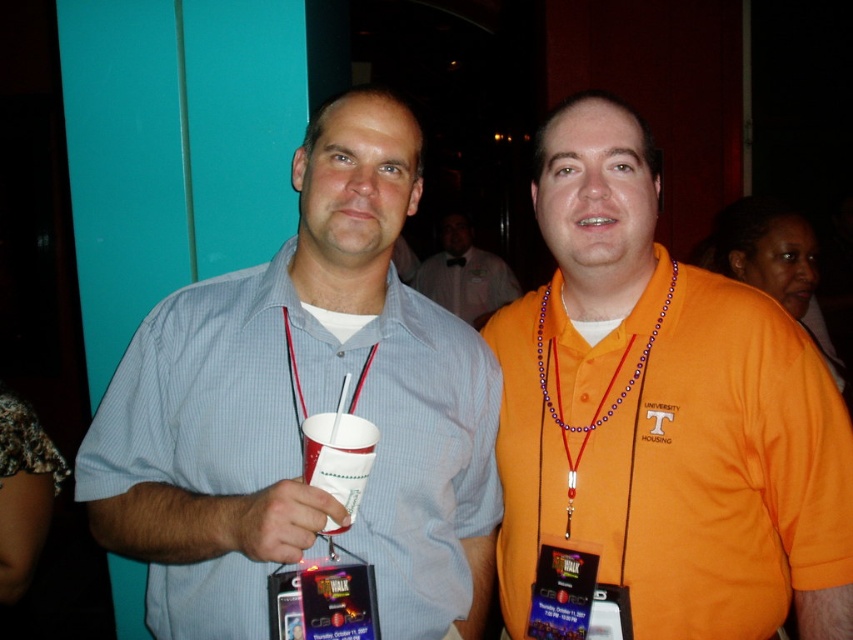
Consider the image. You are at a university event and notice two people standing near each other. You see the matte blue shirt at center and the matte white shirt at center. Which one is positioned to the left?

The matte blue shirt at center is to the left of the matte white shirt at center.